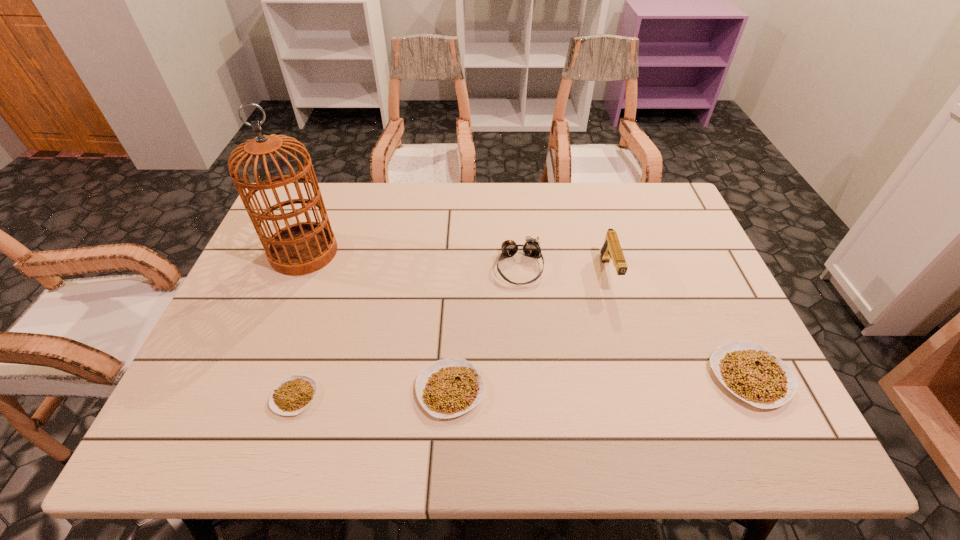
The image size is (960, 540). Identify the location of free point at the near edge. (376, 395).

Where is `vacant space at the left edge of the desktop`? vacant space at the left edge of the desktop is located at coordinates (238, 346).

Identify the location of vacant space at the right edge of the desktop. This screenshot has height=540, width=960. (667, 258).

You are a GUI agent. You are given a task and a screenshot of the screen. Output one action in this format:
    pyautogui.click(x=<x>, y=<y>)
    Task: Click on the blank area at the far left corner
    
    Given the screenshot: What is the action you would take?
    pyautogui.click(x=331, y=187)

You are a GUI agent. You are given a task and a screenshot of the screen. Output one action in this format:
    pyautogui.click(x=<x>, y=<y>)
    Task: Click on the free space at the far right corner of the desktop
    
    Given the screenshot: What is the action you would take?
    [x=639, y=204]

Where is `free space at the near right corner of the desktop`? This screenshot has height=540, width=960. free space at the near right corner of the desktop is located at coordinates (700, 369).

In order to click on empty location between the rightmost legume and the pistol in this screenshot , I will do `click(680, 325)`.

At what (x,y) coordinates should I click in order to perform the action: click on empty space that is in between the rightmost legume and the birdcage. Please return your answer as a coordinate pair (x, y). The height and width of the screenshot is (540, 960). Looking at the image, I should click on (527, 314).

You are a GUI agent. You are given a task and a screenshot of the screen. Output one action in this format:
    pyautogui.click(x=<x>, y=<y>)
    Task: Click on the free point between the birdcage and the fourth shortest object
    
    Given the screenshot: What is the action you would take?
    pyautogui.click(x=412, y=260)

Locate an element on the screen. The width and height of the screenshot is (960, 540). empty space between the second tallest legume and the birdcage is located at coordinates (377, 321).